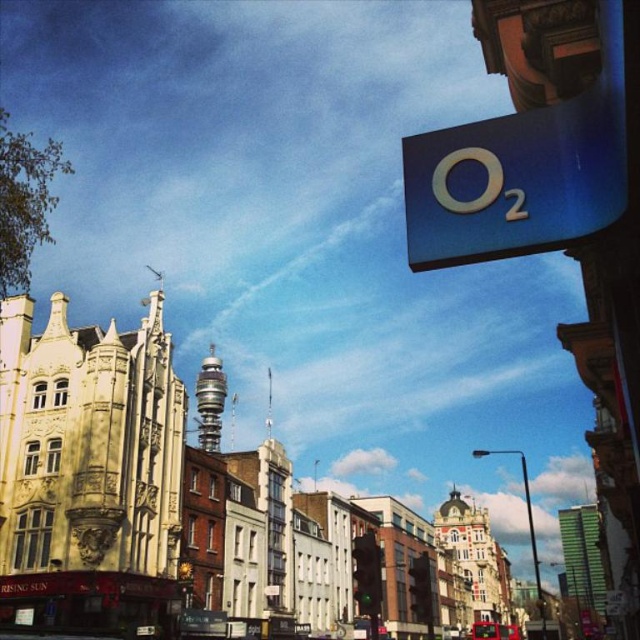
Question: Is blue glossy sign at upper right positioned in front of metallic red bus at lower center?

Choices:
 (A) yes
 (B) no

Answer: (A)

Question: Does blue glossy sign at upper right appear over metallic red bus at lower center?

Choices:
 (A) yes
 (B) no

Answer: (A)

Question: Which of the following is the farthest from the observer?

Choices:
 (A) metallic red bus at lower center
 (B) blue glossy sign at upper right

Answer: (A)

Question: Which of the following is the farthest from the observer?

Choices:
 (A) (598, 115)
 (B) (480, 621)

Answer: (B)

Question: Can you confirm if blue glossy sign at upper right is wider than metallic red bus at lower center?

Choices:
 (A) yes
 (B) no

Answer: (B)

Question: Which object appears closest to the camera in this image?

Choices:
 (A) blue glossy sign at upper right
 (B) metallic red bus at lower center

Answer: (A)